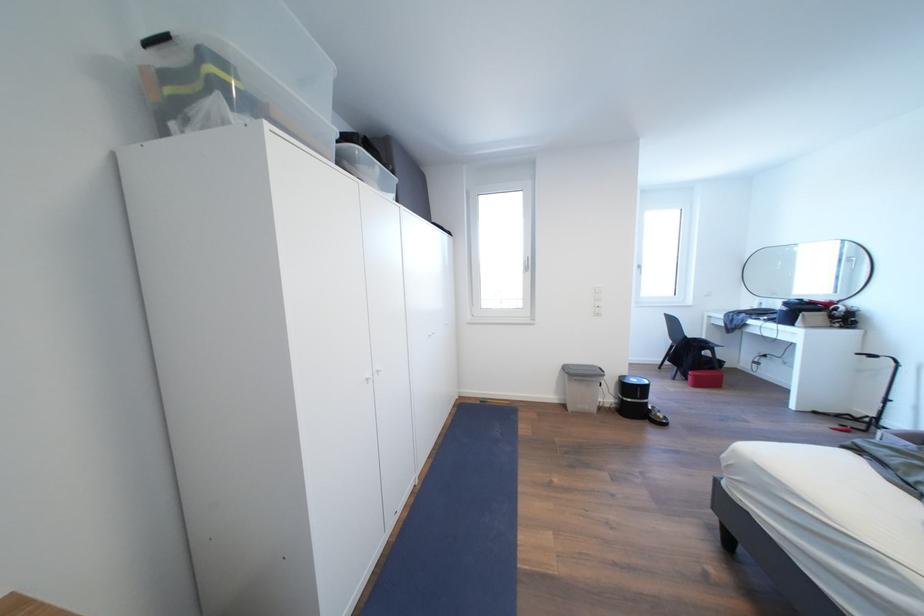
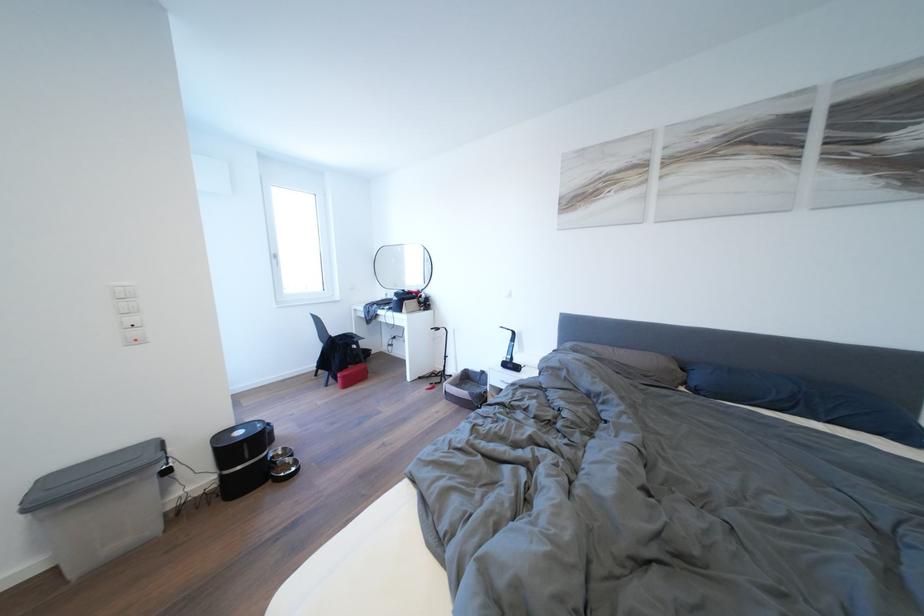
Locate, in the second image, the point that corresponds to pixel 648 272 in the first image.

(284, 261)